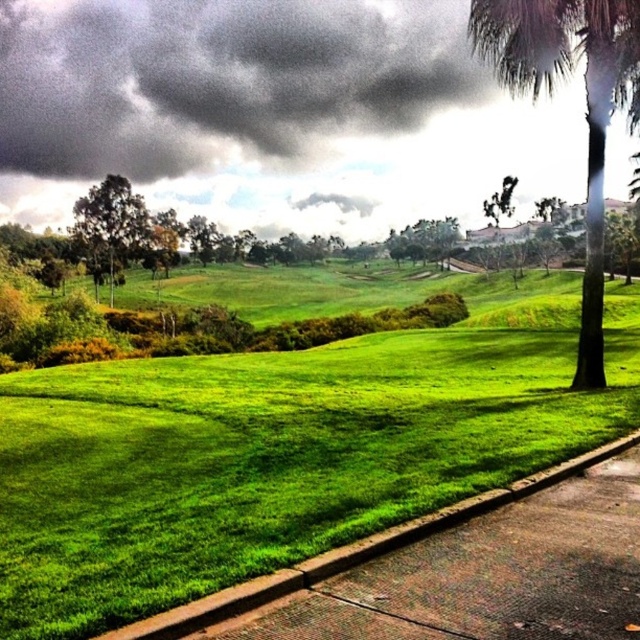
You are standing at the point marked as point (112, 220) in the image. What is the nearest object to you?

The nearest object to you is the green leafy tree at left, as the point (112, 220) is on it.